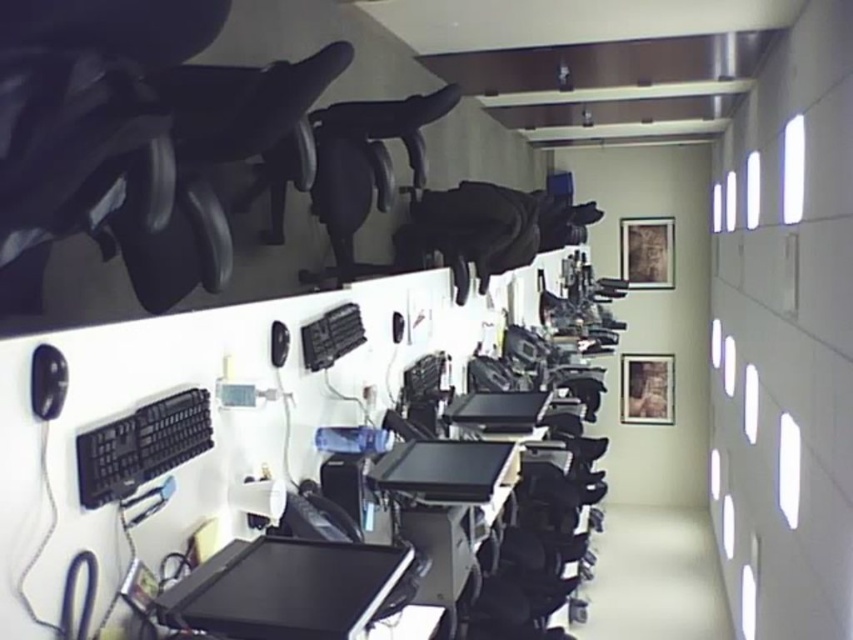
Question: Which object is closer to the camera taking this photo?

Choices:
 (A) black plastic keyboard at lower left
 (B) black matte monitor at center

Answer: (A)

Question: Is black matte monitor at center to the left of black plastic keyboard at lower left from the viewer's perspective?

Choices:
 (A) yes
 (B) no

Answer: (B)

Question: Which object appears closest to the camera in this image?

Choices:
 (A) black matte monitor at center
 (B) black plastic keyboard at lower left

Answer: (B)

Question: Is black matte monitor at center behind black plastic keyboard at lower left?

Choices:
 (A) no
 (B) yes

Answer: (B)

Question: Observing the image, what is the correct spatial positioning of black matte monitor at center in reference to black plastic keyboard at lower left?

Choices:
 (A) above
 (B) below

Answer: (B)